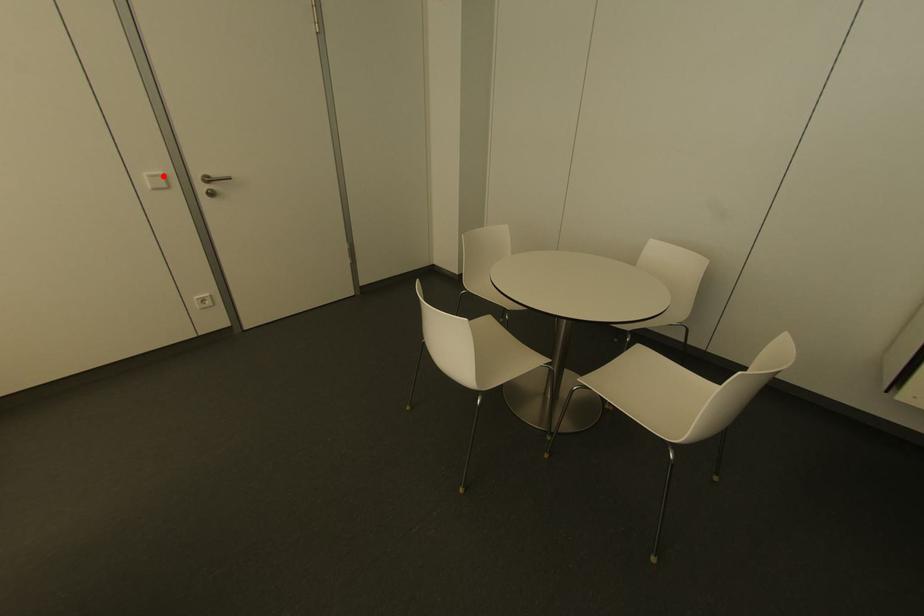
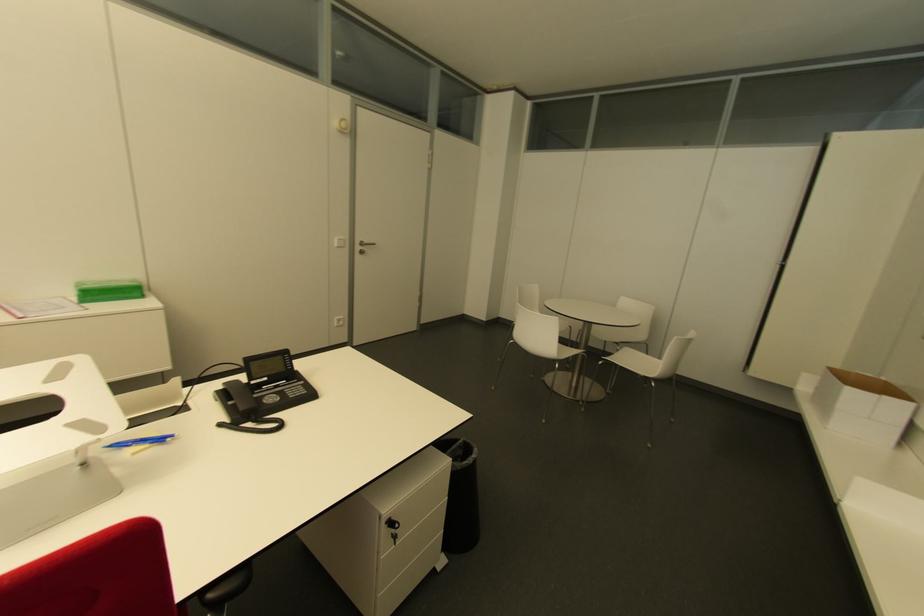
Question: I am providing you with two images of the same scene from different viewpoints. In image1, a red point is highlighted. Considering the same 3D point in image2, which of the following is correct?

Choices:
 (A) It is closer
 (B) It is farther

Answer: (A)